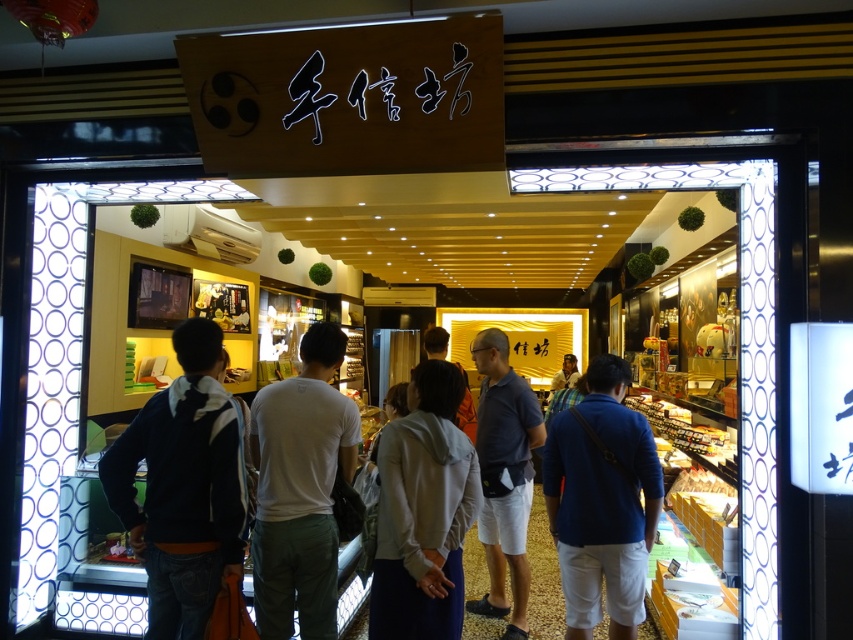
You are a customer entering the store and see the blue cotton shirt at center and the light brown leather jacket at center displayed on a rack. Which clothing item takes up more horizontal space on the rack?

The blue cotton shirt at center has a larger width than the light brown leather jacket at center, so it takes up more horizontal space on the rack.